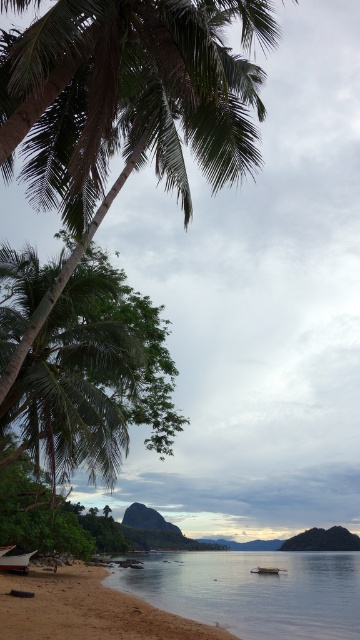
You are standing on the beach and see the clear water at lower center and the wooden boat at lower center. Which object is taller from your perspective?

The clear water at lower center is taller than the wooden boat at lower center according to the description.

You are standing on the beach and want to take a photo of both point (1, 627) and point (5, 566). Which point should you focus on first to ensure both are in clear view?

You should focus on point (1, 627) first because it is closer to the camera than point (5, 566), ensuring both are in focus when using depth of field.

You are standing on the beach looking at the scene. There is a point marked at coordinates (x=253, y=589). What is located at that point?

The point at coordinates (x=253, y=589) marks clear water at lower center.